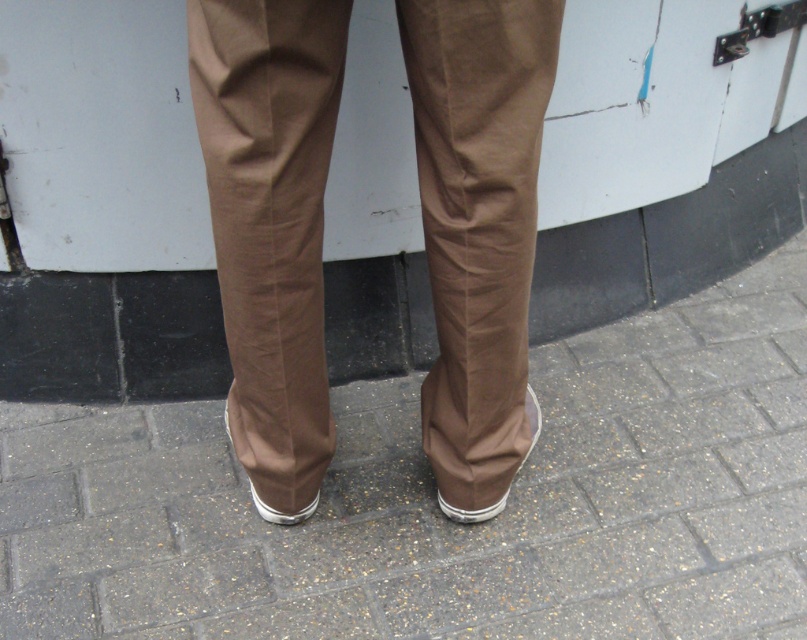
Question: Considering the relative positions of brown fabric pants at center and white rubber shoe at lower center in the image provided, where is brown fabric pants at center located with respect to white rubber shoe at lower center?

Choices:
 (A) below
 (B) above

Answer: (B)

Question: Among these points, which one is farthest from the camera?

Choices:
 (A) (249, 492)
 (B) (256, 36)
 (C) (527, 392)
 (D) (679, 556)

Answer: (A)

Question: Does brown fabric pants at center have a larger size compared to brown cotton pants at center?

Choices:
 (A) no
 (B) yes

Answer: (B)

Question: Which object appears closest to the camera in this image?

Choices:
 (A) matte brown shoe at lower center
 (B) brown fabric pants at center
 (C) white rubber shoe at lower center

Answer: (B)

Question: Which object is farther from the camera taking this photo?

Choices:
 (A) white rubber shoe at lower center
 (B) matte brown shoe at lower center

Answer: (A)

Question: Does brown cotton pants at center have a lesser width compared to white rubber shoe at lower center?

Choices:
 (A) yes
 (B) no

Answer: (B)